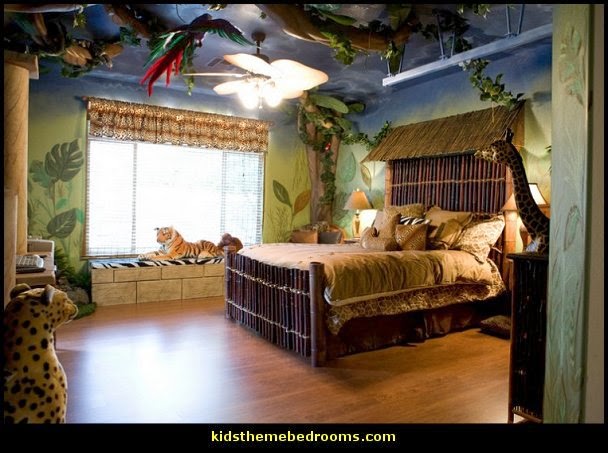
You are a GUI agent. You are given a task and a screenshot of the screen. Output one action in this format:
    pyautogui.click(x=<x>, y=<y>)
    Task: Click on the pillow
    
    Given the screenshot: What is the action you would take?
    pyautogui.click(x=385, y=244), pyautogui.click(x=373, y=230), pyautogui.click(x=390, y=217), pyautogui.click(x=402, y=204), pyautogui.click(x=406, y=220), pyautogui.click(x=409, y=233), pyautogui.click(x=433, y=233), pyautogui.click(x=483, y=254)